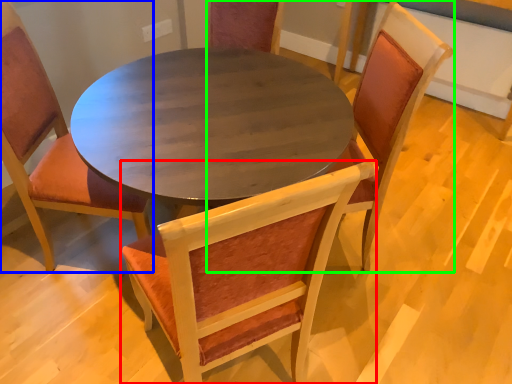
Question: Considering the real-world distances, which object is farthest from chair (highlighted by a red box)? chair (highlighted by a blue box) or chair (highlighted by a green box)?

Choices:
 (A) chair
 (B) chair

Answer: (B)